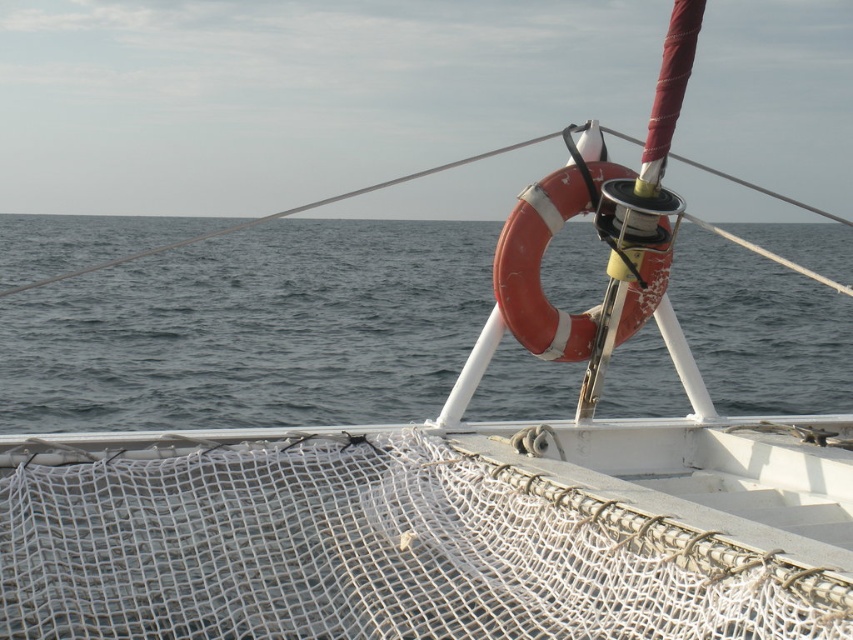
You are standing on the deck of the boat and notice the white mesh net at center and the gray matte water at center. Which object is located below the other?

The white mesh net at center is positioned under the gray matte water at center, so the white mesh net is below the gray matte water.